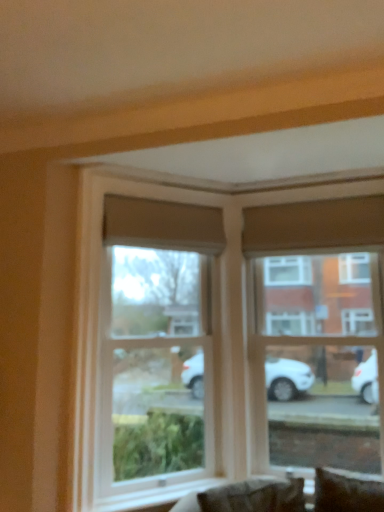
Question: Can you confirm if clear glass window at upper right, the 2th window in the left-to-right sequence, is thinner than dark brown leather couch at lower center?

Choices:
 (A) no
 (B) yes

Answer: (B)

Question: From a real-world perspective, is clear glass window at upper right, the 2th window in the left-to-right sequence, under dark brown leather couch at lower center?

Choices:
 (A) no
 (B) yes

Answer: (A)

Question: Considering the relative sizes of clear glass window at upper right, the first window viewed from the right, and dark brown leather couch at lower center in the image provided, is clear glass window at upper right, the first window viewed from the right, shorter than dark brown leather couch at lower center?

Choices:
 (A) yes
 (B) no

Answer: (B)

Question: Is clear glass window at upper right, the first window viewed from the right, far from dark brown leather couch at lower center?

Choices:
 (A) no
 (B) yes

Answer: (A)

Question: From a real-world perspective, is clear glass window at upper right, the first window viewed from the right, located higher than dark brown leather couch at lower center?

Choices:
 (A) no
 (B) yes

Answer: (B)

Question: Based on their sizes in the image, would you say clear glass window at upper right, the first window viewed from the right, is bigger or smaller than clear glass window at center, the 1th window in the left-to-right sequence?

Choices:
 (A) big
 (B) small

Answer: (B)

Question: Is clear glass window at upper right, the first window viewed from the right, taller or shorter than clear glass window at center, marked as the second window in a right-to-left arrangement?

Choices:
 (A) short
 (B) tall

Answer: (B)

Question: In the image, is clear glass window at upper right, the first window viewed from the right, on the left side or the right side of clear glass window at center, marked as the second window in a right-to-left arrangement?

Choices:
 (A) left
 (B) right

Answer: (B)

Question: In the image, is clear glass window at upper right, the first window viewed from the right, positioned in front of or behind clear glass window at center, marked as the second window in a right-to-left arrangement?

Choices:
 (A) front
 (B) behind

Answer: (B)

Question: Is dark brown leather couch at lower center wider or thinner than clear glass window at upper right, the first window viewed from the right?

Choices:
 (A) wide
 (B) thin

Answer: (A)

Question: From the image's perspective, relative to clear glass window at upper right, the first window viewed from the right, is dark brown leather couch at lower center above or below?

Choices:
 (A) below
 (B) above

Answer: (A)

Question: In the image, is dark brown leather couch at lower center positioned in front of or behind clear glass window at upper right, the 2th window in the left-to-right sequence?

Choices:
 (A) behind
 (B) front

Answer: (B)

Question: Which is correct: dark brown leather couch at lower center is inside clear glass window at upper right, the 2th window in the left-to-right sequence, or outside of it?

Choices:
 (A) outside
 (B) inside

Answer: (A)

Question: Would you say clear glass window at upper right, the 2th window in the left-to-right sequence, is to the left or to the right of dark brown leather couch at lower center in the picture?

Choices:
 (A) left
 (B) right

Answer: (B)

Question: Is clear glass window at upper right, the first window viewed from the right, in front of or behind dark brown leather couch at lower center in the image?

Choices:
 (A) front
 (B) behind

Answer: (B)